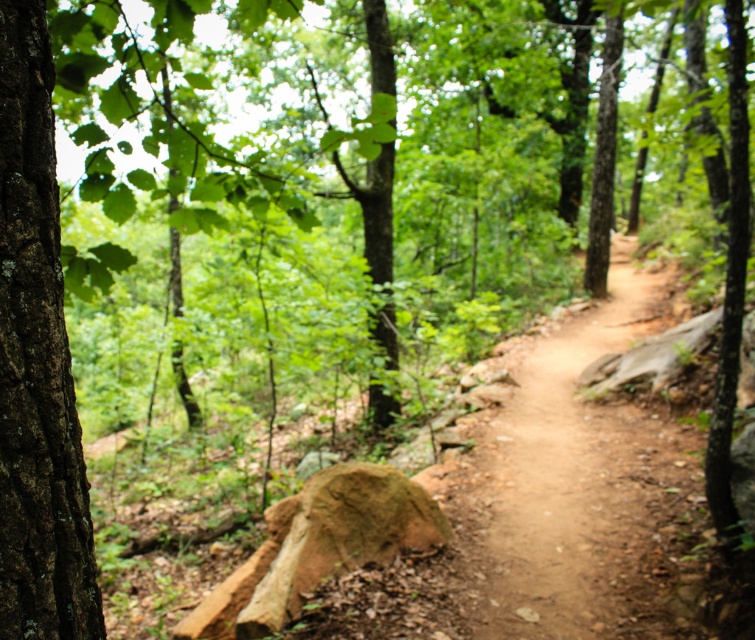
Question: Considering the relative positions of dirt path at center and brown rough bark tree at left in the image provided, where is dirt path at center located with respect to brown rough bark tree at left?

Choices:
 (A) above
 (B) below

Answer: (B)

Question: Does dirt path at center appear on the right side of brown rough bark tree at left?

Choices:
 (A) yes
 (B) no

Answer: (A)

Question: Is dirt path at center thinner than brown rough bark tree at left?

Choices:
 (A) yes
 (B) no

Answer: (B)

Question: Which of the following is the farthest from the observer?

Choices:
 (A) (35, 564)
 (B) (587, 312)

Answer: (B)

Question: Which object is closer to the camera taking this photo?

Choices:
 (A) dirt path at center
 (B) brown rough bark tree at left

Answer: (B)